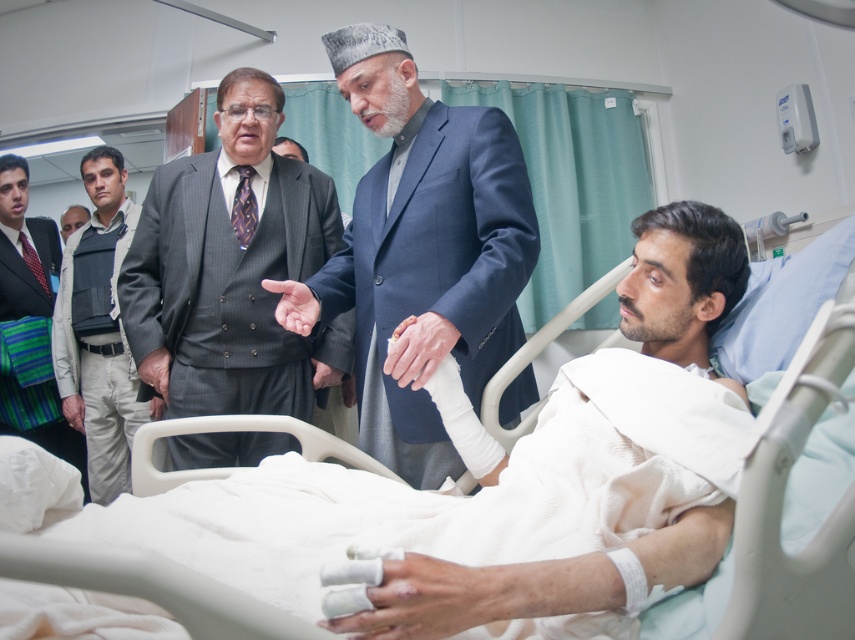
In the scene shown: How far apart are blue woolen suit at center and gray pinstripe suit at center?

They are 14.15 inches apart.

Who is lower down, blue woolen suit at center or gray pinstripe suit at center?

gray pinstripe suit at center is below.

Between point (376, 49) and point (161, 332), which one is positioned behind?

Point (161, 332)

Find the location of a particular element. The image size is (855, 640). blue woolen suit at center is located at coordinates (420, 252).

Which of these two, blue woolen suit at center or white plastic hospital bed at center, stands taller?

blue woolen suit at center

Who is positioned more to the left, blue woolen suit at center or white plastic hospital bed at center?

blue woolen suit at center is more to the left.

Who is more forward, (x=374, y=381) or (x=851, y=464)?

Point (x=851, y=464) is more forward.

Identify the location of blue woolen suit at center. The height and width of the screenshot is (640, 855). (420, 252).

Is point (413, 144) closer to viewer compared to point (28, 406)?

Yes, point (413, 144) is closer to viewer.

Image resolution: width=855 pixels, height=640 pixels. Identify the location of blue woolen suit at center. pos(420,252).